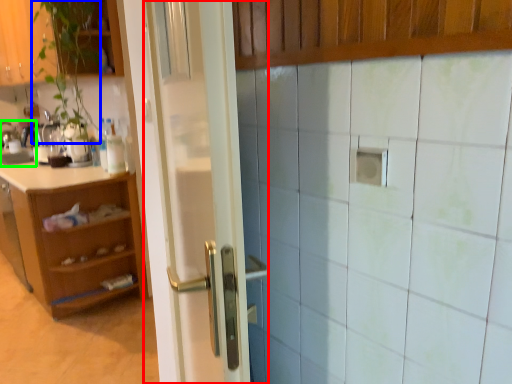
Question: Estimate the real-world distances between objects in this image. Which object is closer to door (highlighted by a red box), plant (highlighted by a blue box) or sink (highlighted by a green box)?

Choices:
 (A) plant
 (B) sink

Answer: (A)